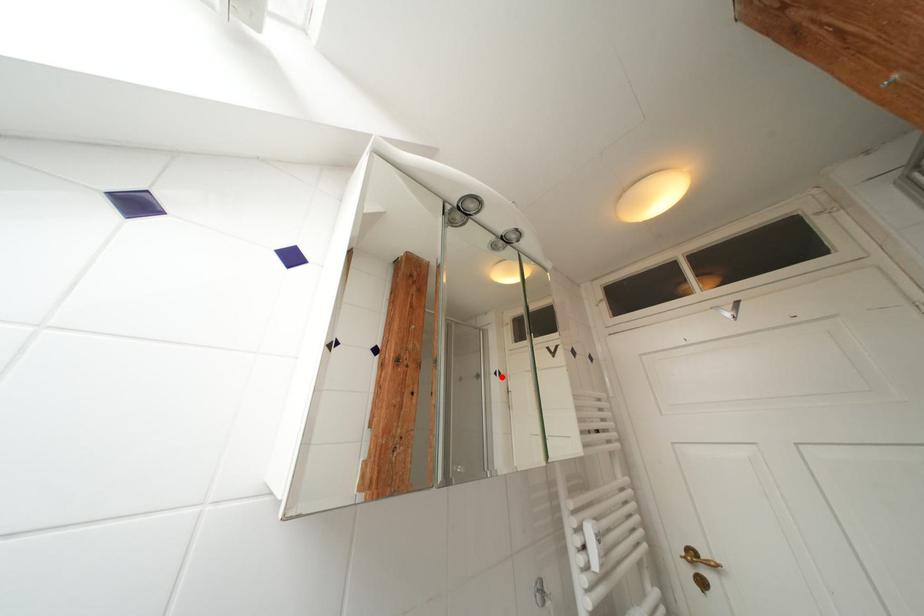
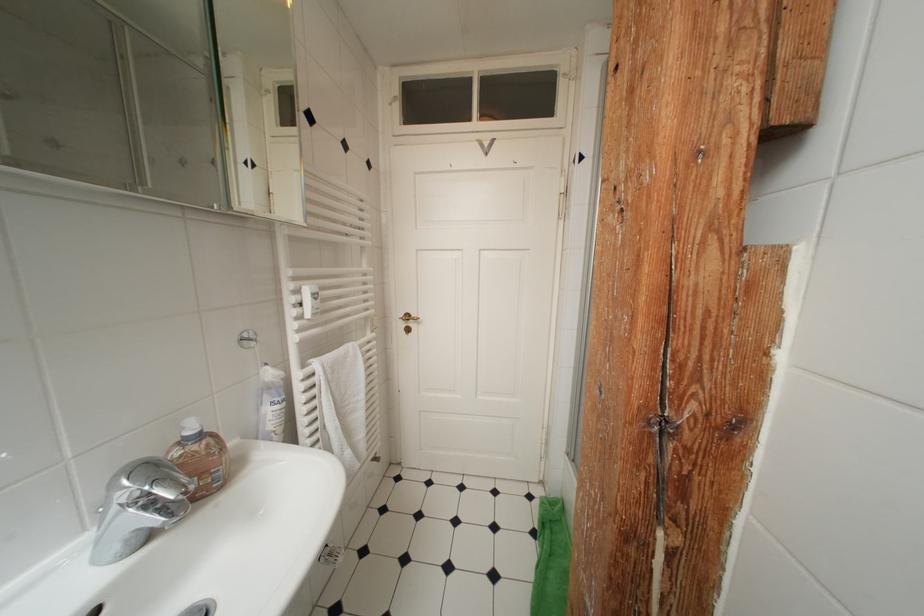
Question: A red point is marked in image1. In image2, is the corresponding 3D point closer to the camera or farther? Reply with the corresponding letter.

Choices:
 (A) The corresponding 3D point is closer.
 (B) The corresponding 3D point is farther.

Answer: (A)